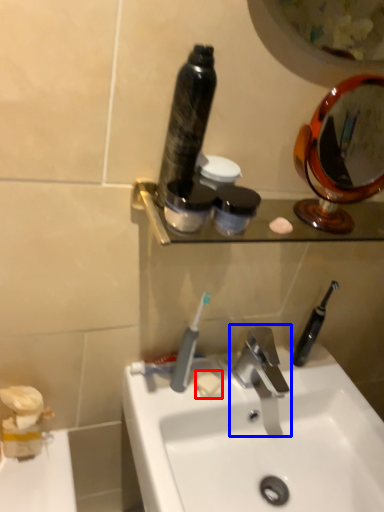
Question: Which object is closer to the camera taking this photo, soap (highlighted by a red box) or tap (highlighted by a blue box)?

Choices:
 (A) soap
 (B) tap

Answer: (B)